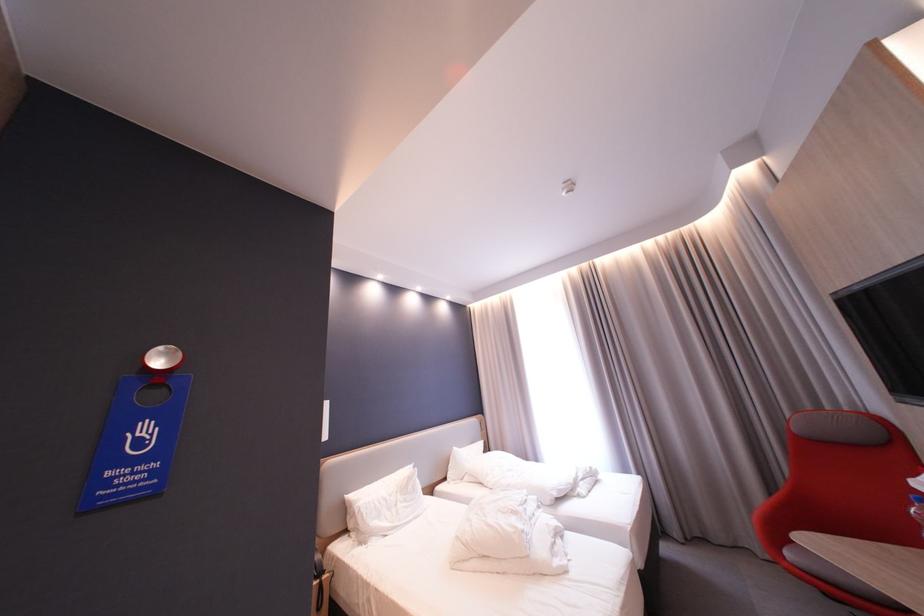
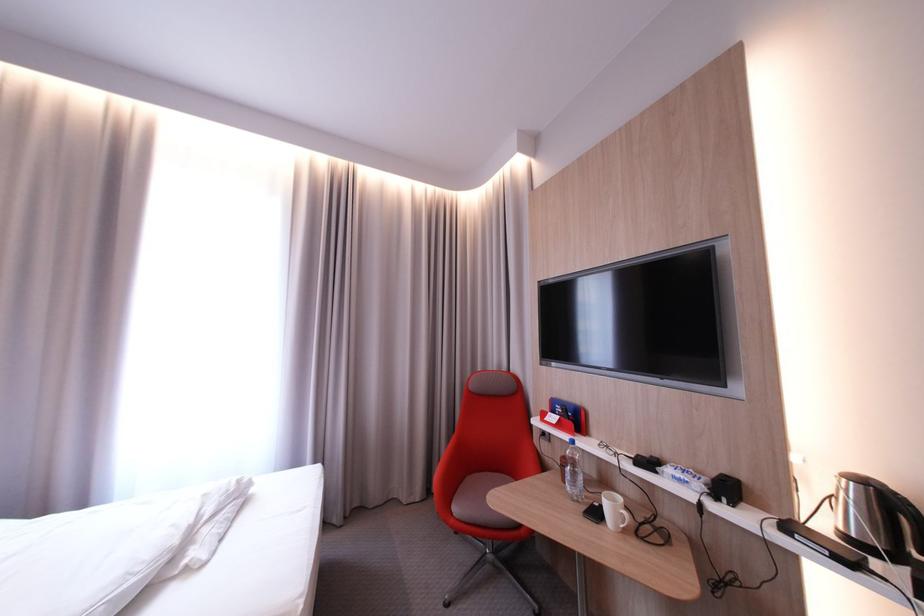
Find the pixel in the second image that matches point 800,554 in the first image.

(467, 511)